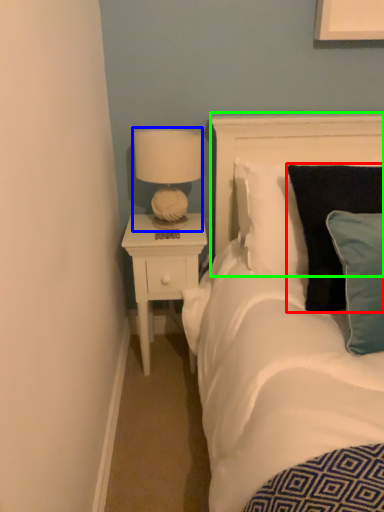
Question: Which is farther away from pillow (highlighted by a red box)? lamp (highlighted by a blue box) or headboard (highlighted by a green box)?

Choices:
 (A) lamp
 (B) headboard

Answer: (A)